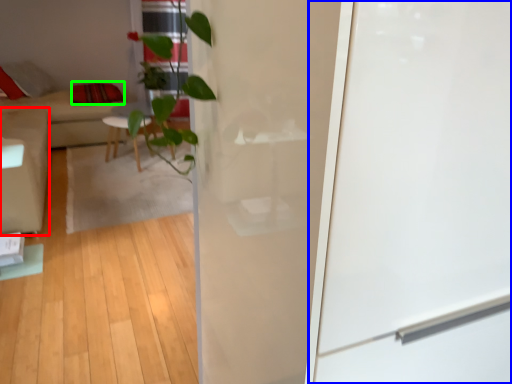
Question: Based on their relative distances, which object is nearer to armchair (highlighted by a red box)? Choose from screen door (highlighted by a blue box) and pillow (highlighted by a green box).

Choices:
 (A) screen door
 (B) pillow

Answer: (B)